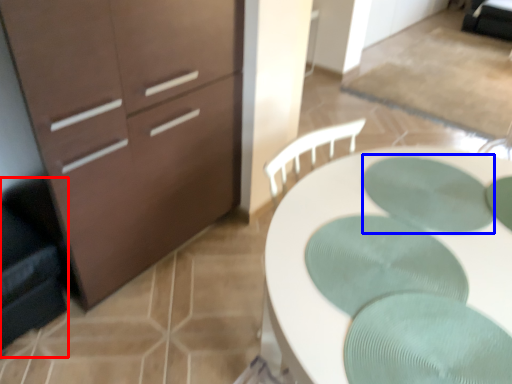
Question: Which of the following is the closest to the observer, swivel chair (highlighted by a red box) or oval (highlighted by a blue box)?

Choices:
 (A) swivel chair
 (B) oval

Answer: (B)